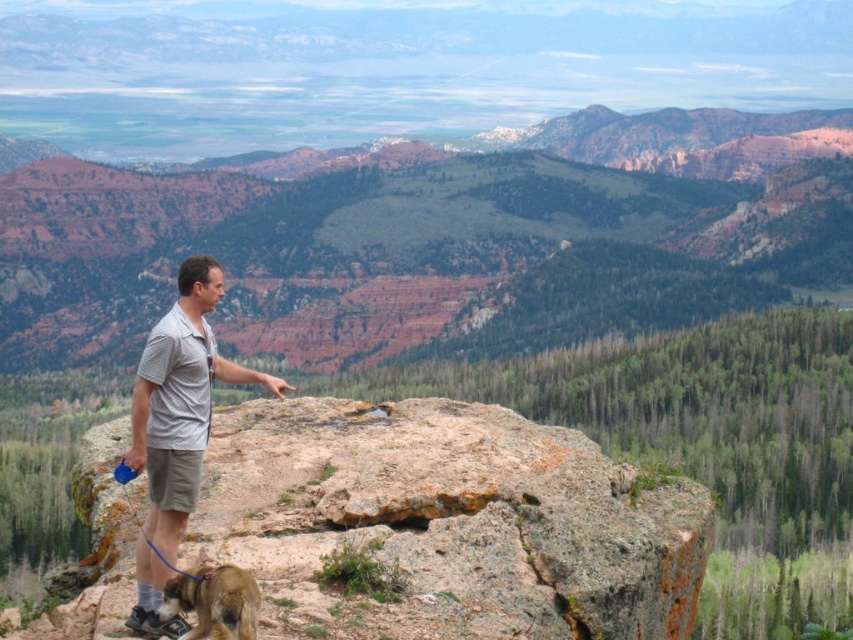
Based on the photo, you are standing at the base of the rocky outcrop and want to reach the point marked at coordinates point [134,385]. If your current elevation is 100 meters and the point is at an elevation of 360.48 meters, will you need to climb upwards to reach it?

Yes, you will need to climb upwards because the point [134,385] is at an elevation of 360.48 meters, which is higher than your current elevation of 100 meters.

You are standing at the top of the rustic rock formation at center and want to get to the brown furry dog at lower left. Which direction should you move?

You should move to the left because the rustic rock formation at center is to the right of the brown furry dog at lower left, so moving left from the rock formation will lead you towards the dog.